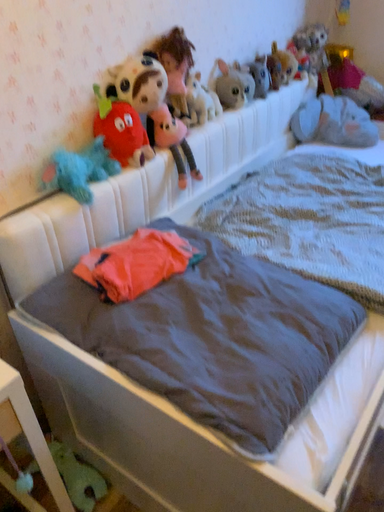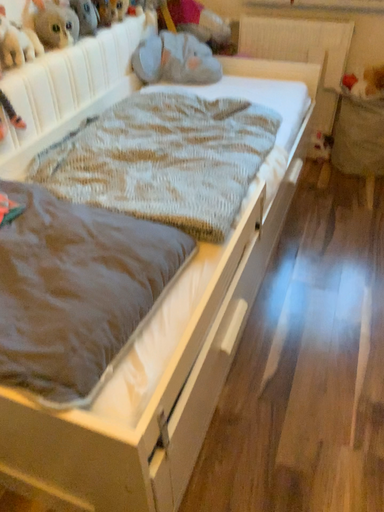
Question: Which way did the camera rotate in the video?

Choices:
 (A) rotated left
 (B) rotated right

Answer: (B)